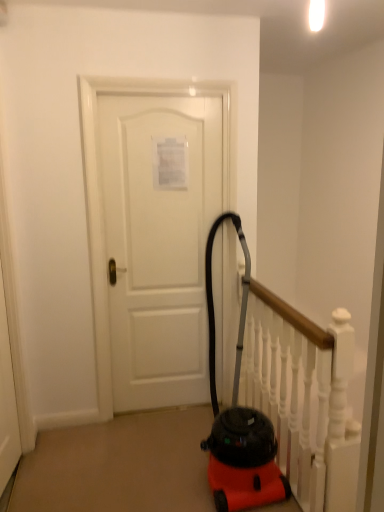
Question: Does white wooden rail at center have a greater height compared to white matte door at center?

Choices:
 (A) no
 (B) yes

Answer: (A)

Question: Is white wooden rail at center facing away from white matte door at center?

Choices:
 (A) no
 (B) yes

Answer: (B)

Question: Does white wooden rail at center appear on the right side of white matte door at center?

Choices:
 (A) yes
 (B) no

Answer: (A)

Question: From the image's perspective, is white wooden rail at center on top of white matte door at center?

Choices:
 (A) no
 (B) yes

Answer: (A)

Question: From a real-world perspective, does white wooden rail at center sit lower than white matte door at center?

Choices:
 (A) no
 (B) yes

Answer: (B)

Question: Is white wooden rail at center directly adjacent to white matte door at center?

Choices:
 (A) yes
 (B) no

Answer: (B)

Question: From a real-world perspective, is white matte door at center under white wooden rail at center?

Choices:
 (A) yes
 (B) no

Answer: (B)

Question: Can you confirm if white matte door at center is thinner than white wooden rail at center?

Choices:
 (A) yes
 (B) no

Answer: (A)

Question: Are white matte door at center and white wooden rail at center far apart?

Choices:
 (A) yes
 (B) no

Answer: (B)

Question: Is white matte door at center smaller than white wooden rail at center?

Choices:
 (A) yes
 (B) no

Answer: (A)

Question: From the image's perspective, is white matte door at center on white wooden rail at center?

Choices:
 (A) no
 (B) yes

Answer: (B)

Question: Does white matte door at center appear on the right side of white wooden rail at center?

Choices:
 (A) yes
 (B) no

Answer: (B)

Question: From the image's perspective, is white matte door at center above or below white wooden rail at center?

Choices:
 (A) above
 (B) below

Answer: (A)